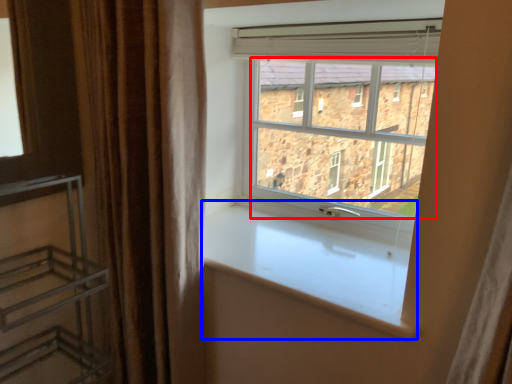
Question: Which point is closer to the camera, window screen (highlighted by a red box) or window sill (highlighted by a blue box)?

Choices:
 (A) window screen
 (B) window sill

Answer: (B)